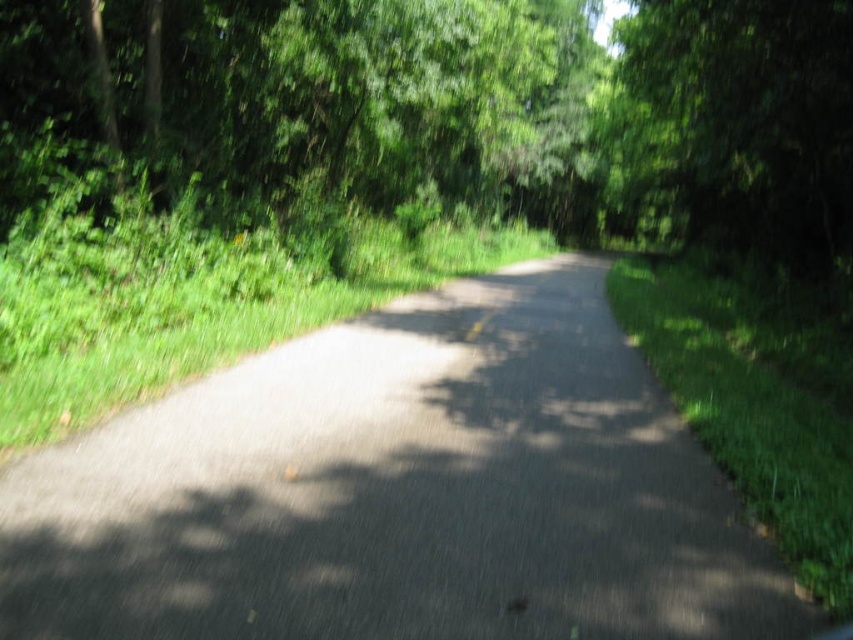
You are standing at the point closer to the starting point of the road and want to walk towards the end of the road. Which point, point [606,397] or point [670,122], is in the direction you are facing?

Point [606,397] is in front of point [670,122], so the point in the direction you are facing is point [606,397].

You are driving a car and want to know if the asphalt road at center will lead you towards the green leafy tree at upper right. Based on the scene, can you determine the direction of the road relative to the tree?

The asphalt road at center is in front of the green leafy tree at upper right, so driving forward along the asphalt road at center will lead you towards the green leafy tree at upper right.

You are a hiker walking along the paved road in the forest. You notice two green leafy trees ahead. One is labeled as green leafy tree at center and the other as green leafy tree at upper right. Which tree would you see first as you continue walking forward?

The green leafy tree at center would be seen first because it is positioned to the left of the green leafy tree at upper right, meaning it is closer to the path as you walk forward.